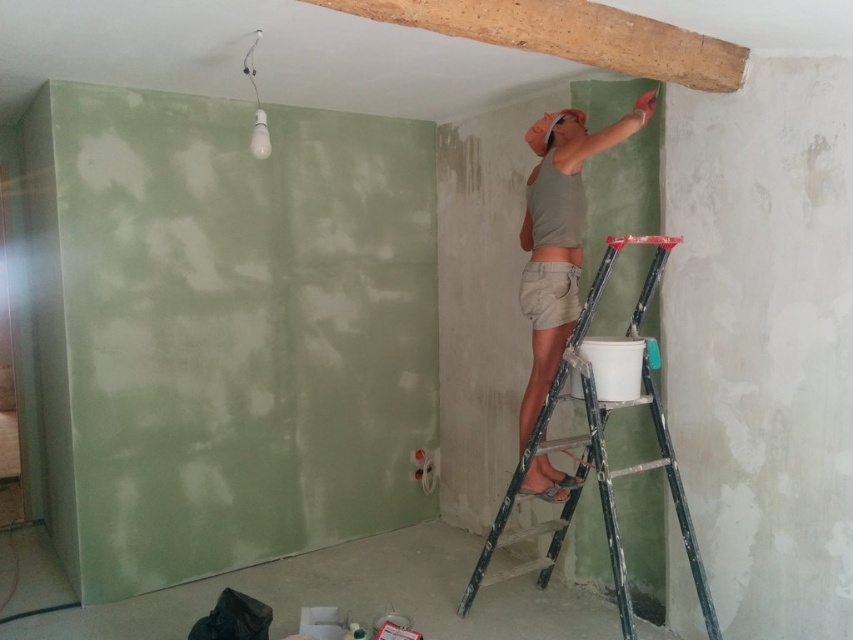
Between metallic silver ladder at upper right and matte green shorts at center, which one is positioned lower?

Positioned lower is metallic silver ladder at upper right.

Is point (520, 536) farther from camera compared to point (640, 128)?

Yes, point (520, 536) is behind point (640, 128).

Identify the location of metallic silver ladder at upper right. Image resolution: width=853 pixels, height=640 pixels. (601, 456).

Which of these two, wooden beam at upper center or matte green shorts at center, stands taller?

Standing taller between the two is matte green shorts at center.

This screenshot has height=640, width=853. What do you see at coordinates (570, 35) in the screenshot?
I see `wooden beam at upper center` at bounding box center [570, 35].

Between point (735, 45) and point (555, 211), which one is positioned behind?

Point (555, 211)

What are the coordinates of `wooden beam at upper center` in the screenshot? It's located at (570, 35).

Which is more to the right, wooden beam at upper center or metallic silver ladder at upper right?

metallic silver ladder at upper right

Can you confirm if wooden beam at upper center is positioned below metallic silver ladder at upper right?

Incorrect, wooden beam at upper center is not positioned below metallic silver ladder at upper right.

Is point (538, 29) closer to viewer compared to point (485, 554)?

That is True.

Find the location of `wooden beam at upper center`. wooden beam at upper center is located at coordinates (570, 35).